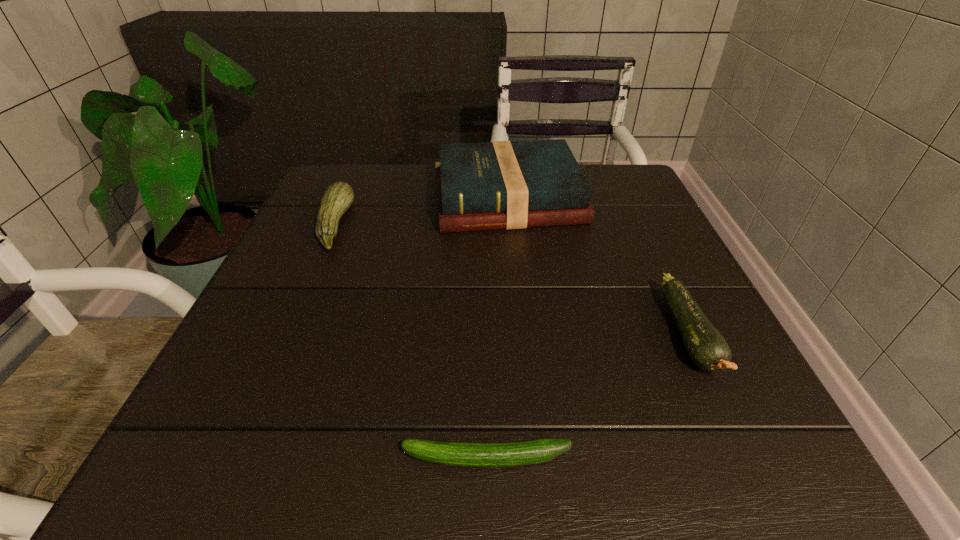
Identify the location of object located at the far right corner. This screenshot has width=960, height=540. (493, 185).

Where is `vacant space at the far edge of the desktop`? This screenshot has width=960, height=540. vacant space at the far edge of the desktop is located at coordinates (394, 173).

In the image, there is a desktop. Where is `vacant space at the near edge`? vacant space at the near edge is located at coordinates (391, 461).

The height and width of the screenshot is (540, 960). In the image, there is a desktop. Find the location of `vacant space at the left edge`. vacant space at the left edge is located at coordinates (288, 404).

The image size is (960, 540). Find the location of `vacant space at the right edge of the desktop`. vacant space at the right edge of the desktop is located at coordinates (724, 336).

Identify the location of free space at the far left corner of the desktop. (361, 213).

Identify the location of blank area at the far right corner. 593,184.

Locate an element on the screen. Image resolution: width=960 pixels, height=540 pixels. vacant region at the near right corner of the desktop is located at coordinates (777, 424).

Find the location of a particular element. vacant space in between the second nearest object and the second zucchini from right to left is located at coordinates (588, 396).

Find the location of a particular element. empty space that is in between the farthest zucchini and the tallest object is located at coordinates (421, 212).